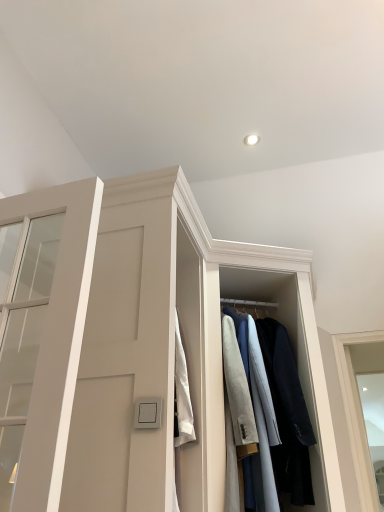
This screenshot has height=512, width=384. What do you see at coordinates (57, 337) in the screenshot? I see `white matte door at left` at bounding box center [57, 337].

The width and height of the screenshot is (384, 512). What are the coordinates of `white matte door at left` in the screenshot? It's located at (57, 337).

What do you see at coordinates (281, 411) in the screenshot? I see `light gray wool coat at center` at bounding box center [281, 411].

Locate an element on the screen. light gray wool coat at center is located at coordinates (281, 411).

At what (x,y) coordinates should I click in order to perform the action: click on white matte door at left. Please return your answer as a coordinate pair (x, y). Looking at the image, I should click on (57, 337).

Considering the relative positions of white matte door at left and light gray wool coat at center in the image provided, is white matte door at left to the right of light gray wool coat at center from the viewer's perspective?

No.

Is white matte door at left positioned behind light gray wool coat at center?

No, white matte door at left is closer to the camera.

Which is less distant, (38, 449) or (275, 412)?

Point (38, 449) appears to be closer to the viewer than point (275, 412).

From the image's perspective, which one is positioned higher, white matte door at left or light gray wool coat at center?

white matte door at left.

From a real-world perspective, is white matte door at left physically below light gray wool coat at center?

Yes, from a real-world perspective, white matte door at left is under light gray wool coat at center.

Considering the sizes of objects white matte door at left and light gray wool coat at center in the image provided, who is thinner, white matte door at left or light gray wool coat at center?

white matte door at left is thinner.

Considering the sizes of white matte door at left and light gray wool coat at center in the image, is white matte door at left taller or shorter than light gray wool coat at center?

Considering their sizes, white matte door at left has less height than light gray wool coat at center.

Can you confirm if white matte door at left is smaller than light gray wool coat at center?

Yes, white matte door at left is smaller than light gray wool coat at center.

Looking at this image, could light gray wool coat at center be considered to be inside white matte door at left?

Actually, light gray wool coat at center is outside white matte door at left.

Are white matte door at left and light gray wool coat at center located far from each other?

white matte door at left is positioned a significant distance from light gray wool coat at center.

Is white matte door at left aimed at light gray wool coat at center?

No, white matte door at left does not turn towards light gray wool coat at center.

At what (x,y) coordinates should I click in order to perform the action: click on door lying above the light gray wool coat at center (from the image's perspective). Please return your answer as a coordinate pair (x, y). The width and height of the screenshot is (384, 512). Looking at the image, I should click on (57, 337).

Is light gray wool coat at center at the left side of white matte door at left?

No, light gray wool coat at center is not to the left of white matte door at left.

Is light gray wool coat at center closer to camera compared to white matte door at left?

No.

Considering the positions of point (237, 325) and point (26, 490), is point (237, 325) closer or farther from the camera than point (26, 490)?

Clearly, point (237, 325) is more distant from the camera than point (26, 490).

From the image's perspective, which one is positioned lower, light gray wool coat at center or white matte door at left?

light gray wool coat at center is shown below in the image.

From a real-world perspective, who is located higher, light gray wool coat at center or white matte door at left?

From a 3D spatial view, light gray wool coat at center is above.

Which of these two, light gray wool coat at center or white matte door at left, is thinner?

white matte door at left is thinner.

Considering the relative sizes of light gray wool coat at center and white matte door at left in the image provided, is light gray wool coat at center shorter than white matte door at left?

No.

In the scene shown: Considering the sizes of light gray wool coat at center and white matte door at left in the image, is light gray wool coat at center bigger or smaller than white matte door at left?

light gray wool coat at center is bigger than white matte door at left.

Is white matte door at left a part of light gray wool coat at center?

Actually, white matte door at left is outside light gray wool coat at center.

Is light gray wool coat at center touching white matte door at left?

No, light gray wool coat at center is not in contact with white matte door at left.

Is light gray wool coat at center facing towards white matte door at left?

No.

Can you tell me how much light gray wool coat at center and white matte door at left differ in facing direction?

There is a 30.8-degree angle between the facing directions of light gray wool coat at center and white matte door at left.

You are a GUI agent. You are given a task and a screenshot of the screen. Output one action in this format:
    pyautogui.click(x=<x>, y=<y>)
    Task: Click on the door that is above the light gray wool coat at center (from the image's perspective)
    Image resolution: width=384 pixels, height=512 pixels.
    Given the screenshot: What is the action you would take?
    (57, 337)

Find the location of a particular element. clothing above the white matte door at left (from a real-world perspective) is located at coordinates (281, 411).

Locate an element on the screen. door to the left of light gray wool coat at center is located at coordinates (57, 337).